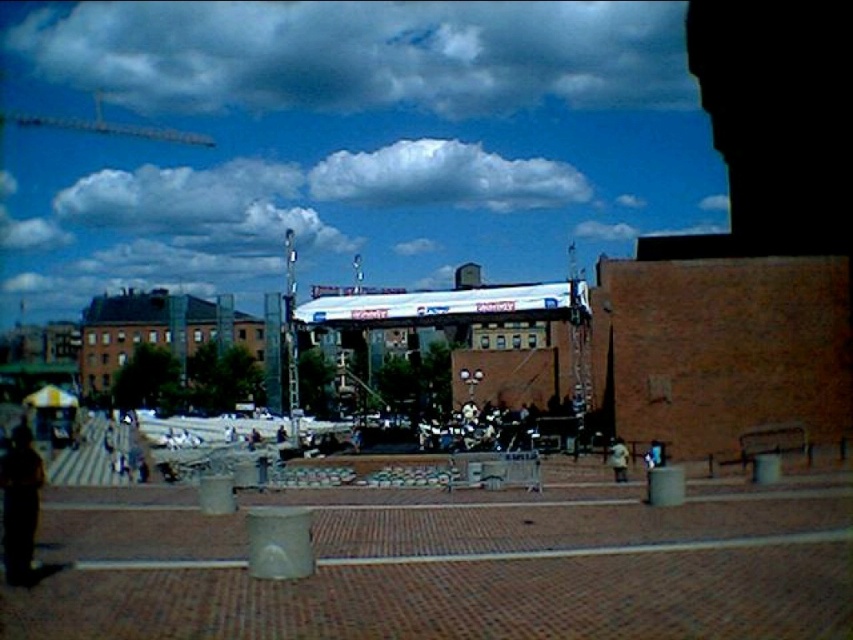
Consider the image. You are standing at the edge of the paved area and see the concrete at center and the dark brown leather jacket at lower left. Which object is closer to your right side?

The concrete at center is to the right of dark brown leather jacket at lower left, so the concrete at center is closer to your right side.

You are standing on the paved area and see both the dark brown leather jacket at lower left and the light brown leather jacket at lower right. Which jacket is closer to the ground?

The dark brown leather jacket at lower left is closer to the ground because it is located below the light brown leather jacket at lower right.